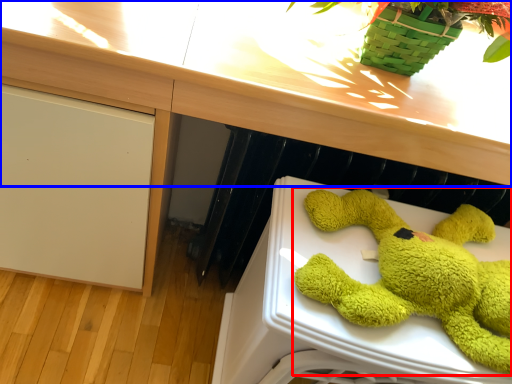
Question: Which object appears farthest to the camera in this image, toy (highlighted by a red box) or counter top (highlighted by a blue box)?

Choices:
 (A) toy
 (B) counter top

Answer: (B)